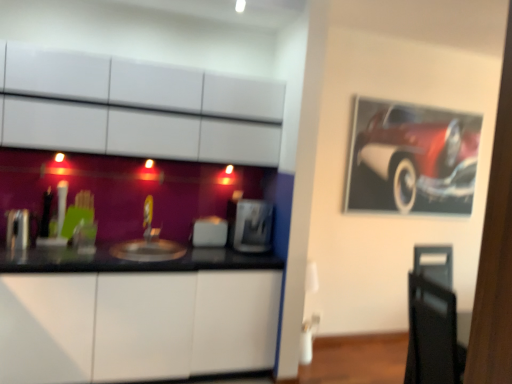
The height and width of the screenshot is (384, 512). Describe the element at coordinates (136, 325) in the screenshot. I see `white glossy cabinet at lower left, the second cabinetry when ordered from top to bottom` at that location.

Identify the location of matte silver sink at center. Image resolution: width=512 pixels, height=384 pixels. (148, 250).

This screenshot has width=512, height=384. What do you see at coordinates (17, 229) in the screenshot?
I see `satin silver toaster at left, the first appliance from the front` at bounding box center [17, 229].

Find the location of a particular element. The width and height of the screenshot is (512, 384). white glossy cabinets at upper center, the 2th cabinetry in the bottom-to-top sequence is located at coordinates (137, 108).

What do you see at coordinates (250, 225) in the screenshot? The image size is (512, 384). I see `satin silver toaster at center, which ranks as the 3th appliance in left-to-right order` at bounding box center [250, 225].

In order to face satin silver toaster at center, which appears as the 2th appliance when viewed from the front, should I rotate leftwards or rightwards?

Rotate left and turn 0.715 degrees.

Identify the location of white glossy cabinet at lower left, which is the 1th cabinetry from bottom to top. (136, 325).

How distant is satin silver toaster at left, the 3th appliance when ordered from right to left, from shiny red car at upper right?

satin silver toaster at left, the 3th appliance when ordered from right to left, and shiny red car at upper right are 9.97 feet apart.

Is satin silver toaster at left, the first appliance in the left-to-right sequence, oriented away from shiny red car at upper right?

satin silver toaster at left, the first appliance in the left-to-right sequence, is not turned away from shiny red car at upper right.

Can you confirm if satin silver toaster at left, which is counted as the third appliance, starting from the back, is shorter than shiny red car at upper right?

Yes, satin silver toaster at left, which is counted as the third appliance, starting from the back, is shorter than shiny red car at upper right.

Where is `land vehicle behind the satin silver toaster at left, which is counted as the third appliance, starting from the back`? Image resolution: width=512 pixels, height=384 pixels. land vehicle behind the satin silver toaster at left, which is counted as the third appliance, starting from the back is located at coordinates (412, 159).

Which of these two, satin silver toaster at left, the first appliance from the front, or satin silver toaster at center, positioned as the 2th appliance in left-to-right order, stands shorter?

Standing shorter between the two is satin silver toaster at center, positioned as the 2th appliance in left-to-right order.

Does point (15, 223) come farther from viewer compared to point (217, 231)?

No.

From a real-world perspective, is satin silver toaster at left, which is counted as the third appliance, starting from the back, positioned over satin silver toaster at center, positioned as the 2th appliance in left-to-right order, based on gravity?

Correct, in the physical world, satin silver toaster at left, which is counted as the third appliance, starting from the back, is higher than satin silver toaster at center, positioned as the 2th appliance in left-to-right order.

From a real-world perspective, starting from the satin silver toaster at center, the second appliance when ordered from right to left, which appliance is the 1st one vertically above it? Please provide its 2D coordinates.

[(17, 229)]

Can satin silver toaster at center, which ranks as the 3th appliance in left-to-right order, be found inside satin silver toaster at center, the second appliance when ordered from right to left?

No, satin silver toaster at center, which ranks as the 3th appliance in left-to-right order, is not surrounded by satin silver toaster at center, the second appliance when ordered from right to left.

How much distance is there between satin silver toaster at center, the second appliance when ordered from right to left, and satin silver toaster at center, which ranks as the 3th appliance in left-to-right order?

The distance of satin silver toaster at center, the second appliance when ordered from right to left, from satin silver toaster at center, which ranks as the 3th appliance in left-to-right order, is 7.18 inches.

Who is smaller, satin silver toaster at center, positioned as the 2th appliance in left-to-right order, or satin silver toaster at center, which appears as the 2th appliance when viewed from the front?

satin silver toaster at center, positioned as the 2th appliance in left-to-right order, is smaller.

Between satin silver toaster at center, placed as the 1th appliance when sorted from back to front, and satin silver toaster at center, which ranks as the first appliance in right-to-left order, which one appears on the left side from the viewer's perspective?

Positioned to the left is satin silver toaster at center, placed as the 1th appliance when sorted from back to front.

From the image's perspective, is white glossy cabinet at lower left, the second cabinetry when ordered from top to bottom, on top of satin silver toaster at center, which appears as the 2th appliance when viewed from the front?

Actually, white glossy cabinet at lower left, the second cabinetry when ordered from top to bottom, appears below satin silver toaster at center, which appears as the 2th appliance when viewed from the front, in the image.

Based on their positions, is white glossy cabinet at lower left, the second cabinetry when ordered from top to bottom, located to the left or right of satin silver toaster at center, which appears as the 2th appliance when viewed from the front?

white glossy cabinet at lower left, the second cabinetry when ordered from top to bottom, is positioned on satin silver toaster at center, which appears as the 2th appliance when viewed from the front,'s left side.

Which of these two, white glossy cabinet at lower left, the second cabinetry when ordered from top to bottom, or satin silver toaster at center, which appears as the 2th appliance when viewed from the front, is thinner?

satin silver toaster at center, which appears as the 2th appliance when viewed from the front, is thinner.

From the image's perspective, count 2nd appliances upward from the white glossy cabinet at lower left, which is the 1th cabinetry from bottom to top, and point to it. Please provide its 2D coordinates.

[(250, 225)]

Which of these two, matte silver sink at center or satin silver toaster at center, positioned as the 2th appliance in left-to-right order, is wider?

matte silver sink at center.

Which object is closer to the camera, matte silver sink at center or satin silver toaster at center, which appears as the third appliance when viewed from the front?

matte silver sink at center is more forward.

Considering the relative sizes of matte silver sink at center and satin silver toaster at center, the second appliance when ordered from right to left, in the image provided, is matte silver sink at center bigger than satin silver toaster at center, the second appliance when ordered from right to left,?

Indeed, matte silver sink at center has a larger size compared to satin silver toaster at center, the second appliance when ordered from right to left.

In the scene shown: Between matte silver sink at center and satin silver toaster at center, positioned as the 2th appliance in left-to-right order, which one has less height?

Standing shorter between the two is matte silver sink at center.

Is the depth of shiny red car at upper right less than that of white glossy cabinets at upper center, which ranks as the first cabinetry in top-to-bottom order?

No, shiny red car at upper right is further to the viewer.

Can you confirm if shiny red car at upper right is positioned to the left of white glossy cabinets at upper center, the 2th cabinetry in the bottom-to-top sequence?

Incorrect, shiny red car at upper right is not on the left side of white glossy cabinets at upper center, the 2th cabinetry in the bottom-to-top sequence.

Is shiny red car at upper right not within white glossy cabinets at upper center, the 2th cabinetry in the bottom-to-top sequence?

That's correct, shiny red car at upper right is outside of white glossy cabinets at upper center, the 2th cabinetry in the bottom-to-top sequence.

Would you say matte silver sink at center is outside satin silver toaster at center, the second appliance positioned from the back?

Yes.

Looking at their sizes, would you say matte silver sink at center is wider or thinner than satin silver toaster at center, which appears as the 2th appliance when viewed from the front?

matte silver sink at center is wider than satin silver toaster at center, which appears as the 2th appliance when viewed from the front.

Who is smaller, matte silver sink at center or satin silver toaster at center, which ranks as the 3th appliance in left-to-right order?

With smaller size is matte silver sink at center.

How many degrees apart are the facing directions of matte silver sink at center and satin silver toaster at center, which ranks as the 3th appliance in left-to-right order?

The angular difference between matte silver sink at center and satin silver toaster at center, which ranks as the 3th appliance in left-to-right order, is 4.08 degrees.

Locate an element on the screen. land vehicle behind the satin silver toaster at left, which is counted as the third appliance, starting from the back is located at coordinates (412, 159).

Image resolution: width=512 pixels, height=384 pixels. What are the coordinates of `appliance that is the 1st object to the right of the satin silver toaster at left, the first appliance from the front, starting at the anchor` in the screenshot? It's located at (209, 232).

Looking at the image, which one is located closer to satin silver toaster at left, the first appliance in the left-to-right sequence, white glossy cabinet at lower left, the second cabinetry when ordered from top to bottom, or white glossy cabinets at upper center, the 2th cabinetry in the bottom-to-top sequence?

white glossy cabinet at lower left, the second cabinetry when ordered from top to bottom.

Estimate the real-world distances between objects in this image. Which object is closer to white glossy cabinet at lower left, which is the 1th cabinetry from bottom to top, satin silver toaster at center, which appears as the third appliance when viewed from the front, or shiny red car at upper right?

satin silver toaster at center, which appears as the third appliance when viewed from the front, lies closer to white glossy cabinet at lower left, which is the 1th cabinetry from bottom to top, than the other object.

Estimate the real-world distances between objects in this image. Which object is further from satin silver toaster at center, which ranks as the 3th appliance in left-to-right order, satin silver toaster at center, positioned as the 2th appliance in left-to-right order, or shiny red car at upper right?

The object further to satin silver toaster at center, which ranks as the 3th appliance in left-to-right order, is shiny red car at upper right.

Estimate the real-world distances between objects in this image. Which object is closer to satin silver toaster at center, the second appliance positioned from the back, satin silver toaster at center, placed as the 1th appliance when sorted from back to front, or satin silver toaster at left, the first appliance from the front?

Based on the image, satin silver toaster at center, placed as the 1th appliance when sorted from back to front, appears to be nearer to satin silver toaster at center, the second appliance positioned from the back.

From the image, which object appears to be nearer to white glossy cabinets at upper center, the 2th cabinetry in the bottom-to-top sequence, satin silver toaster at left, the first appliance in the left-to-right sequence, or satin silver toaster at center, the second appliance when ordered from right to left?

The object closer to white glossy cabinets at upper center, the 2th cabinetry in the bottom-to-top sequence, is satin silver toaster at center, the second appliance when ordered from right to left.

In the scene shown: When comparing their distances from satin silver toaster at center, which ranks as the 3th appliance in left-to-right order, does shiny red car at upper right or satin silver toaster at left, the 3th appliance when ordered from right to left, seem further?

Based on the image, satin silver toaster at left, the 3th appliance when ordered from right to left, appears to be further to satin silver toaster at center, which ranks as the 3th appliance in left-to-right order.

From the image, which object appears to be farther from white glossy cabinet at lower left, which is the 1th cabinetry from bottom to top, satin silver toaster at left, the first appliance from the front, or matte silver sink at center?

satin silver toaster at left, the first appliance from the front.

Looking at the image, which one is located further to white glossy cabinet at lower left, the second cabinetry when ordered from top to bottom, matte silver sink at center or satin silver toaster at center, which ranks as the first appliance in right-to-left order?

The object further to white glossy cabinet at lower left, the second cabinetry when ordered from top to bottom, is satin silver toaster at center, which ranks as the first appliance in right-to-left order.

In order to click on sink between white glossy cabinets at upper center, the 2th cabinetry in the bottom-to-top sequence, and white glossy cabinet at lower left, the second cabinetry when ordered from top to bottom, vertically in this screenshot , I will do `click(148, 250)`.

Where is `sink located between satin silver toaster at left, the first appliance from the front, and shiny red car at upper right in the left-right direction`? sink located between satin silver toaster at left, the first appliance from the front, and shiny red car at upper right in the left-right direction is located at coordinates (148, 250).

Locate an element on the screen. cabinetry between white glossy cabinet at lower left, which is the 1th cabinetry from bottom to top, and shiny red car at upper right from left to right is located at coordinates (137, 108).

Locate an element on the screen. sink between white glossy cabinet at lower left, the second cabinetry when ordered from top to bottom, and shiny red car at upper right is located at coordinates 148,250.